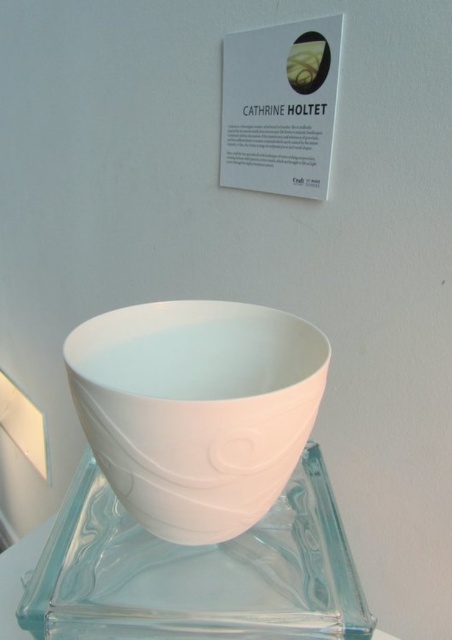
Consider the image. You are standing in front of the white matte bowl at center and the transparent glass plate at center. Which object is nearer to you?

The white matte bowl at center is closer to the viewer than the transparent glass plate at center.

What object is located at the coordinates point (197, 410) in the image?

The point (197, 410) indicates the white matte bowl at center.

You are an interior designer planning to place a decorative item at point coordinates of 0.5, 0.5. Considering the current placement of the white matte bowl at center, will this new item overlap with the bowl?

The white matte bowl at center is located at point coordinates of (197,410), so placing a new item at (226,320) would not overlap with the bowl.